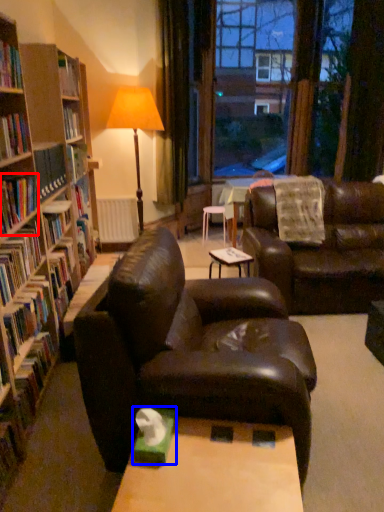
Question: Which object appears farthest to the camera in this image, book (highlighted by a red box) or paperback book (highlighted by a blue box)?

Choices:
 (A) book
 (B) paperback book

Answer: (A)